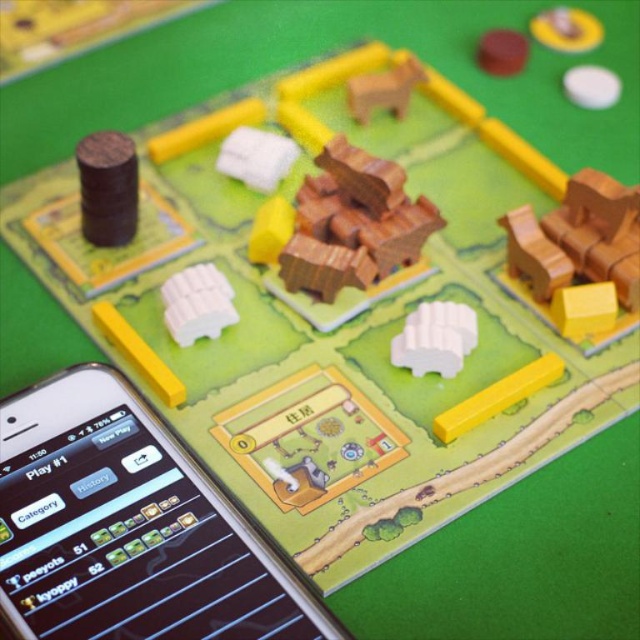
Question: Based on their relative distances, which object is nearer to the wooden house at center?

Choices:
 (A) dark brown wood cylinder at left
 (B) wooden horse at upper center

Answer: (B)

Question: Estimate the real-world distances between objects in this image. Which object is closer to the wooden horse at upper center?

Choices:
 (A) wooden horse at right
 (B) wooden house at center

Answer: (B)

Question: Is wooden house at center below wooden horse at upper center?

Choices:
 (A) yes
 (B) no

Answer: (A)

Question: Which object is positioned farthest from the wooden house at center?

Choices:
 (A) black glossy smartphone at lower left
 (B) dark brown wood cylinder at left

Answer: (A)

Question: Does wooden house at center have a greater width compared to white matte gear at center?

Choices:
 (A) yes
 (B) no

Answer: (A)

Question: Can you confirm if black glossy smartphone at lower left is thinner than white matte gear at center?

Choices:
 (A) no
 (B) yes

Answer: (A)